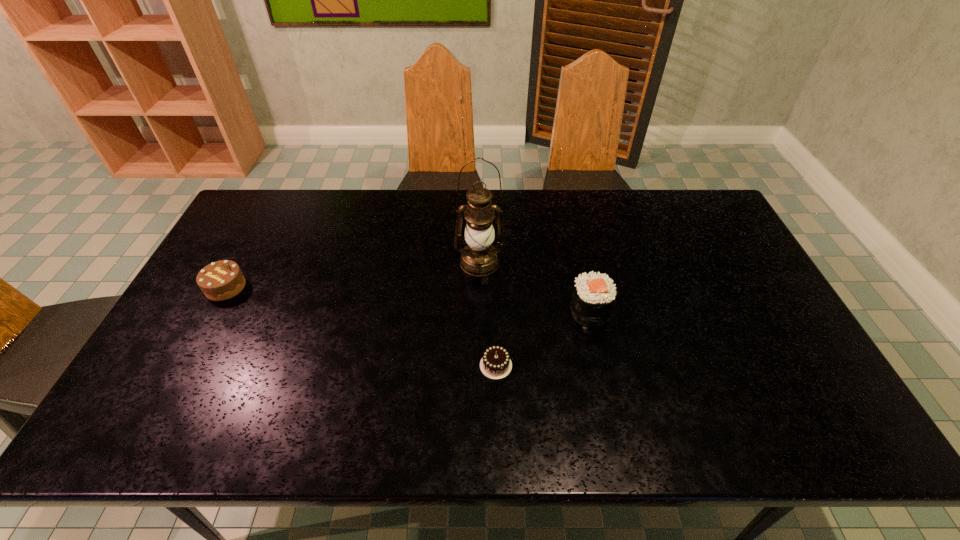
Identify the location of the tallest object. (479, 258).

The height and width of the screenshot is (540, 960). Identify the location of sushi. (593, 297).

This screenshot has width=960, height=540. I want to click on the second tallest object, so click(593, 297).

Locate an element on the screen. The image size is (960, 540). the taller chocolate cake is located at coordinates (221, 280).

The image size is (960, 540). Find the location of `the leftmost object`. the leftmost object is located at coordinates (221, 280).

The width and height of the screenshot is (960, 540). Identify the location of the nearer chocolate cake. (495, 364).

You are a GUI agent. You are given a task and a screenshot of the screen. Output one action in this format:
    pyautogui.click(x=<x>, y=<y>)
    Task: Click on the shorter chocolate cake
    The height and width of the screenshot is (540, 960).
    Given the screenshot: What is the action you would take?
    pyautogui.click(x=495, y=364)

Find the location of a particular element. This screenshot has width=960, height=540. free region located on the front of the oil lamp is located at coordinates (479, 335).

Where is `vacant space located on the right of the second tallest object`? This screenshot has width=960, height=540. vacant space located on the right of the second tallest object is located at coordinates (641, 310).

Where is `free space located 0.200m on the front of the farther chocolate cake`? free space located 0.200m on the front of the farther chocolate cake is located at coordinates (185, 361).